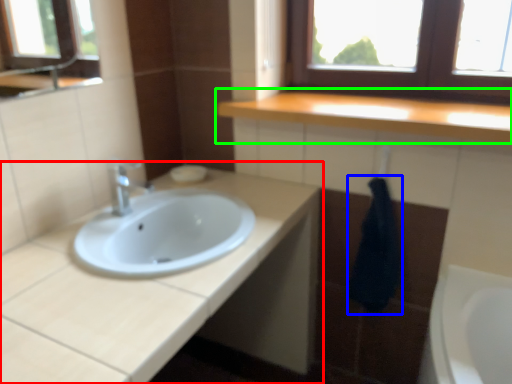
Question: Based on their relative distances, which object is nearer to bathroom cabinet (highlighted by a red box)? Choose from bath towel (highlighted by a blue box) and countertop (highlighted by a green box).

Choices:
 (A) bath towel
 (B) countertop

Answer: (A)